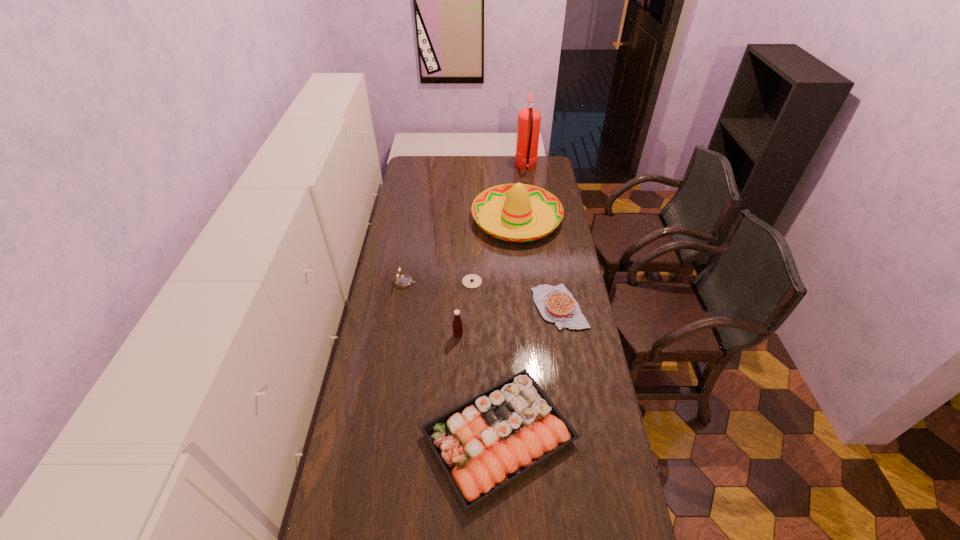
Locate an element on the screen. Image resolution: width=960 pixels, height=540 pixels. fire extinguisher is located at coordinates (528, 127).

The image size is (960, 540). What are the coordinates of `the tallest object` in the screenshot? It's located at (528, 127).

Where is `the second farthest object`? the second farthest object is located at coordinates (519, 202).

Find the location of a particular element. This screenshot has width=960, height=540. the second tallest object is located at coordinates (519, 202).

Where is `Tabasco sauce`? Tabasco sauce is located at coordinates (457, 324).

Where is `the leftmost object`? the leftmost object is located at coordinates (403, 281).

I want to click on the fourth tallest object, so point(403,281).

Locate an element on the screen. This screenshot has height=540, width=960. the third shortest object is located at coordinates (512, 426).

The image size is (960, 540). I want to click on platter, so click(x=512, y=426).

Identify the location of the right compass. The image size is (960, 540). (471, 281).